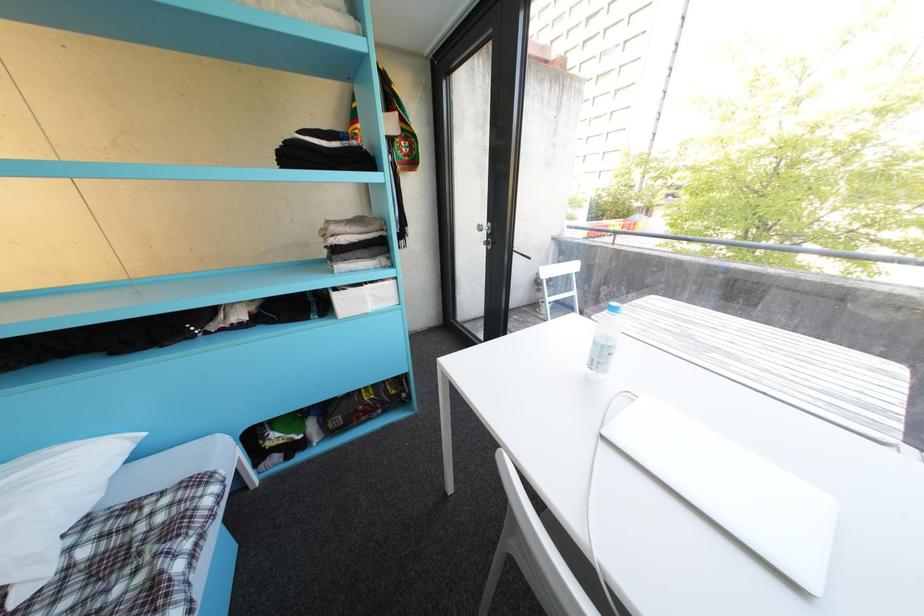
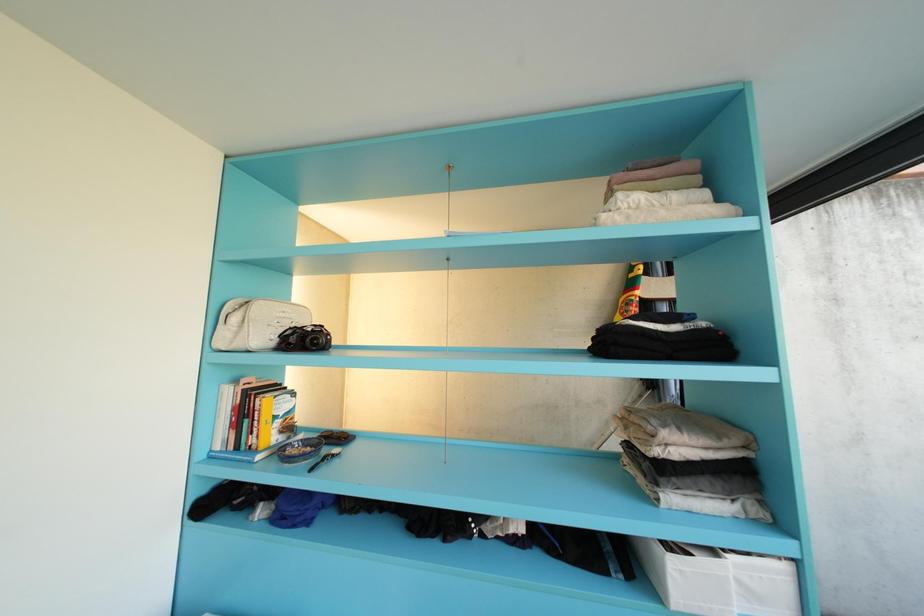
Based on the continuous images, in which direction is the camera rotating?

The camera rotated toward left-up.